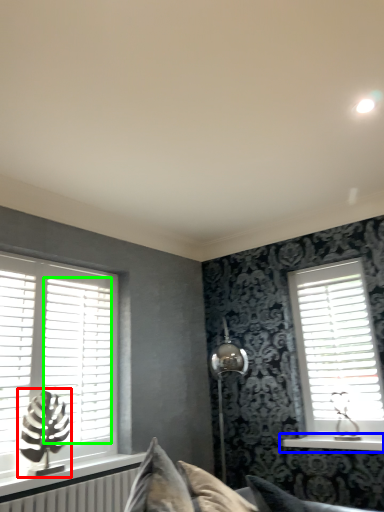
Question: Based on their relative distances, which object is nearer to table lamp (highlighted by a red box)? Choose from window sill (highlighted by a blue box) and blind (highlighted by a green box).

Choices:
 (A) window sill
 (B) blind

Answer: (B)